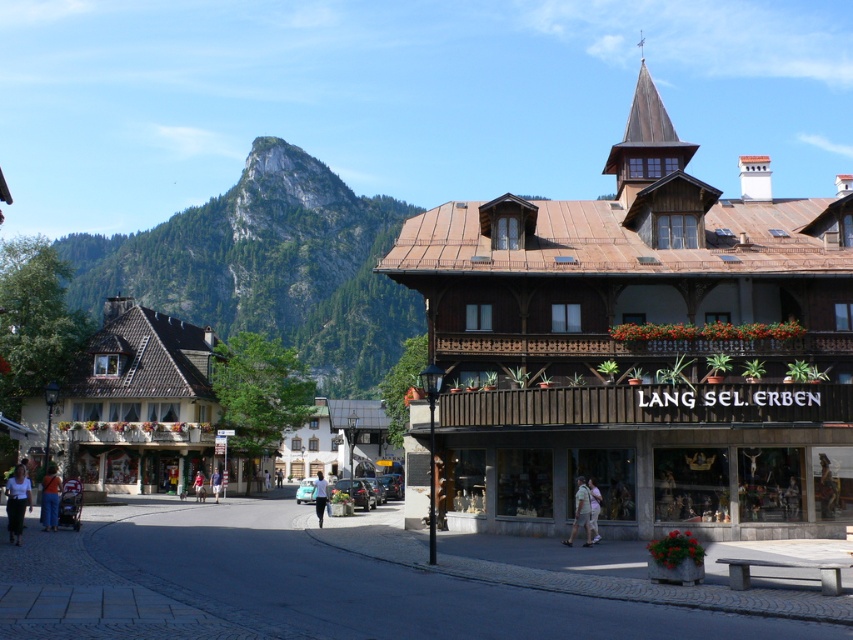
You are standing in the European town square and want to walk from point A to point B. Point A is located at coordinates point (292, 342) and point B is at point (16, 525). Since the square has a cobblestone street that curves gently, will you have to walk towards the background or towards the foreground to reach point B from point A?

To reach point B from point A, you will have to walk towards the background because point A is further to the viewer than point B according to their coordinates.

You are a drone operator tasked with capturing aerial footage of the European town square. Your drone has a maximum flight range of 200 meters from its starting point. If you position the drone at the rocky cliff at upper left, can it reach the white cotton shirt at lower left without exceeding its range?

The distance between the rocky cliff at upper left and the white cotton shirt at lower left is 216.15 meters. Since the drone has a maximum range of 200 meters, it cannot reach the white cotton shirt at lower left without exceeding its range.

You are a fashion designer observing the European town square scene. You notice two clothing items in the image. Which clothing item has a bigger size between the denim pants at lower left and the light blue denim shorts at center?

The denim pants at lower left has a larger size compared to the light blue denim shorts at center.